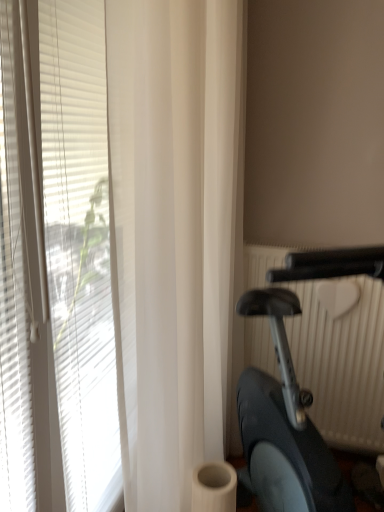
Question: Is metallic silver stationary bicycle at right positioned far away from white matte blinds at left?

Choices:
 (A) yes
 (B) no

Answer: (B)

Question: Is metallic silver stationary bicycle at right bigger than white matte blinds at left?

Choices:
 (A) no
 (B) yes

Answer: (B)

Question: Can you confirm if metallic silver stationary bicycle at right is positioned to the left of white matte blinds at left?

Choices:
 (A) no
 (B) yes

Answer: (A)

Question: From the image's perspective, is metallic silver stationary bicycle at right under white matte blinds at left?

Choices:
 (A) no
 (B) yes

Answer: (B)

Question: Is the depth of metallic silver stationary bicycle at right less than that of white matte blinds at left?

Choices:
 (A) yes
 (B) no

Answer: (A)

Question: Considering the relative sizes of metallic silver stationary bicycle at right and white matte blinds at left in the image provided, is metallic silver stationary bicycle at right shorter than white matte blinds at left?

Choices:
 (A) yes
 (B) no

Answer: (A)

Question: Is white matte blinds at left surrounding metallic silver stationary bicycle at right?

Choices:
 (A) yes
 (B) no

Answer: (B)

Question: Is white matte blinds at left turned away from metallic silver stationary bicycle at right?

Choices:
 (A) yes
 (B) no

Answer: (A)

Question: Does white matte blinds at left have a greater width compared to metallic silver stationary bicycle at right?

Choices:
 (A) yes
 (B) no

Answer: (B)

Question: Does white matte blinds at left have a lesser height compared to metallic silver stationary bicycle at right?

Choices:
 (A) yes
 (B) no

Answer: (B)

Question: From a real-world perspective, is white matte blinds at left physically below metallic silver stationary bicycle at right?

Choices:
 (A) yes
 (B) no

Answer: (B)

Question: Is white matte blinds at left bigger than metallic silver stationary bicycle at right?

Choices:
 (A) yes
 (B) no

Answer: (B)

Question: Is point (362, 269) positioned closer to the camera than point (231, 301)?

Choices:
 (A) farther
 (B) closer

Answer: (B)